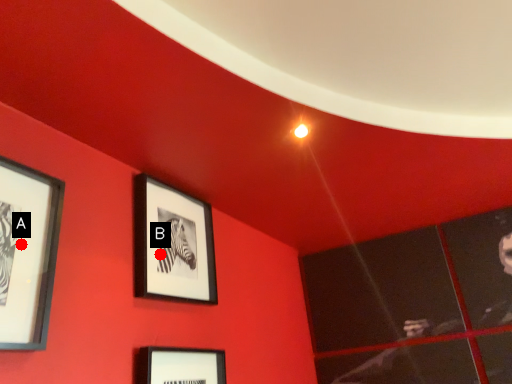
Question: Two points are circled on the image, labeled by A and B beside each circle. Which point is farther to the camera?

Choices:
 (A) A is further
 (B) B is further

Answer: (B)